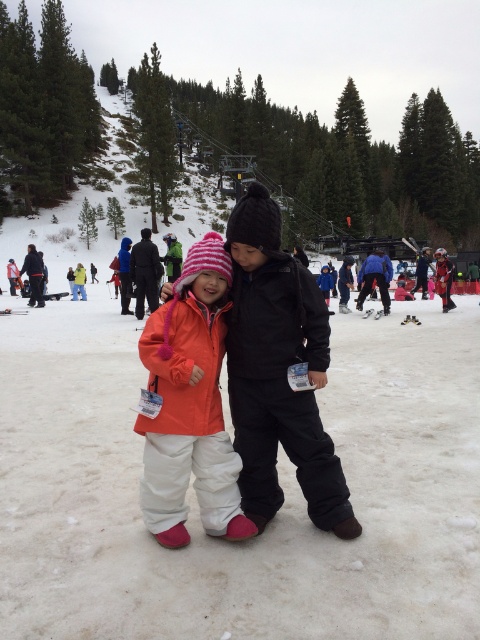
Consider the image. You are a photographer trying to capture a photo of both the black matte jacket at center and the orange fleece jacket at center. Since you want both subjects to be in the frame, which direction should you move your camera to include both?

The black matte jacket at center is to the right of orange fleece jacket at center, so to include both in the frame, you should move your camera slightly to the left to capture both subjects.

What are the coordinates of the orange softshell jacket at center?

The orange softshell jacket at center is located at coordinates point (190, 404).

You are a photographer trying to capture a photo of the orange fleece jacket at center and the black matte jacket at center. Which jacket should you focus on first if you want to ensure both are in the frame without moving the camera?

The black matte jacket at center is positioned under the orange fleece jacket at center, so you should focus on the orange fleece jacket at center first to ensure both are in the frame without moving the camera.